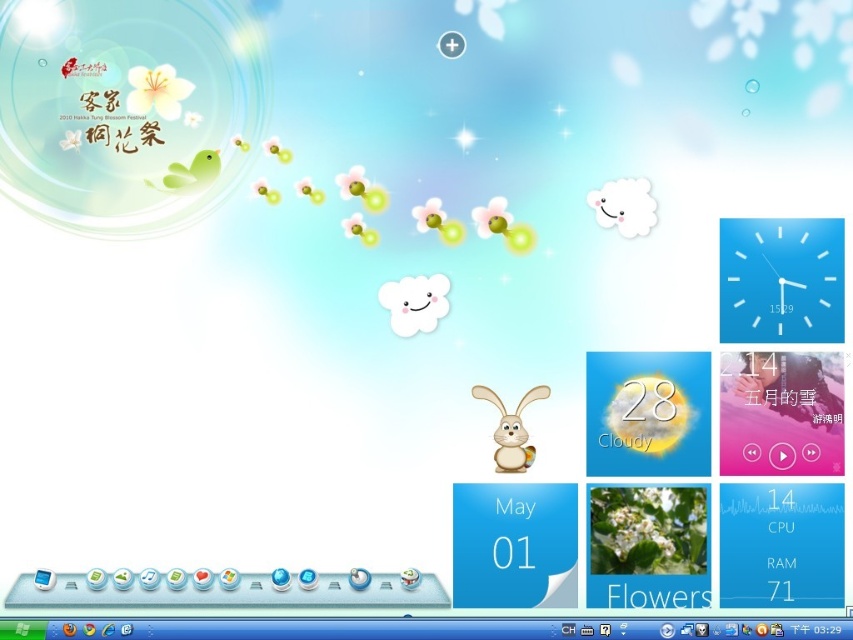
Question: Is white plastic clock at upper right positioned behind white matte rabbit at center?

Choices:
 (A) yes
 (B) no

Answer: (B)

Question: Is the position of white plastic clock at upper right less distant than that of white matte rabbit at center?

Choices:
 (A) yes
 (B) no

Answer: (A)

Question: Among these objects, which one is nearest to the camera?

Choices:
 (A) white plastic clock at upper right
 (B) white matte rabbit at center

Answer: (A)

Question: Which point appears closest to the camera in this image?

Choices:
 (A) (523, 440)
 (B) (833, 339)

Answer: (B)

Question: Which object is closer to the camera taking this photo?

Choices:
 (A) white matte rabbit at center
 (B) white plastic clock at upper right

Answer: (B)

Question: Can you confirm if white plastic clock at upper right is positioned above white matte rabbit at center?

Choices:
 (A) yes
 (B) no

Answer: (A)